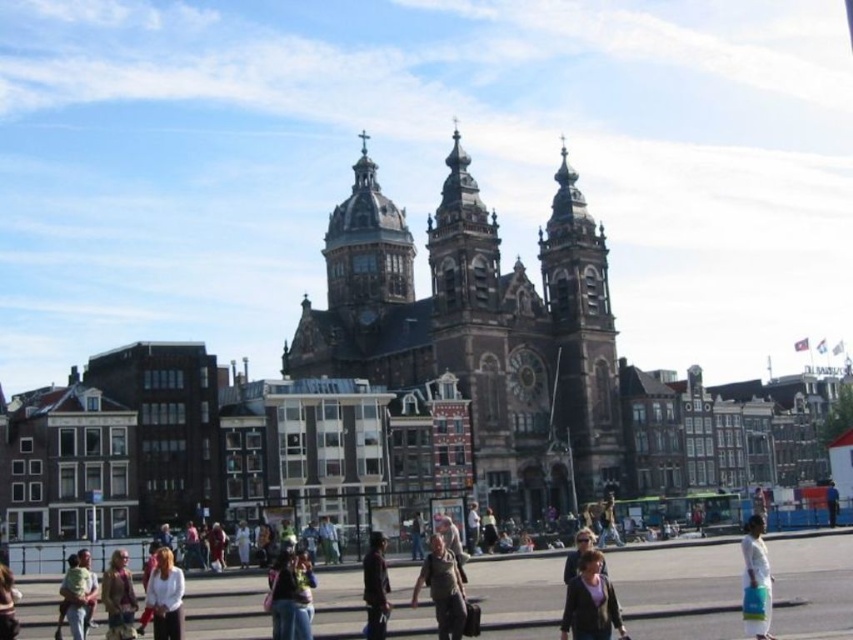
What is the 2D coordinate of the light brown hair at lower left?

The light brown hair at lower left is located at the 2D coordinate point of (165, 596).

You are a delivery person carrying a package that requires a 10 meter clearance to pass through a narrow alleyway. You see a light brown hair at lower left and a dark brown leather jacket at lower center in the scene. Can you safely navigate your delivery cart between them without hitting either?

The distance between the light brown hair at lower left and dark brown leather jacket at lower center is 9.57 meters, which is slightly less than the required 10 meter clearance. Therefore, navigating the delivery cart between them may not be safe as there isn

You are a photographer standing in the bustling urban scene in front of the historic church. You want to capture a photo of the two people with the light brown hair at lower left and the white matte jacket at lower right. Which person has a shorter height?

The light brown hair at lower left is shorter than the white matte jacket at lower right, so the person with the light brown hair at lower left is shorter in height.